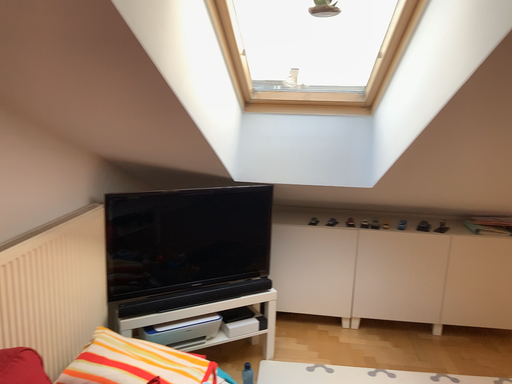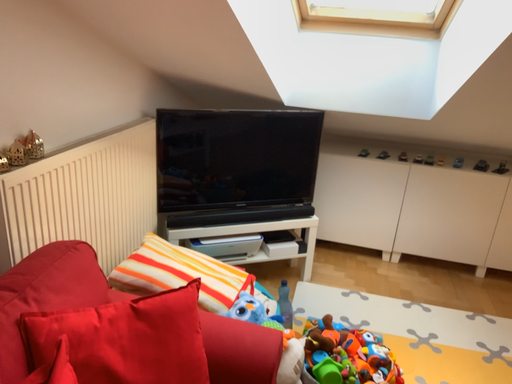
Question: Which way did the camera rotate in the video?

Choices:
 (A) rotated right
 (B) rotated left

Answer: (B)